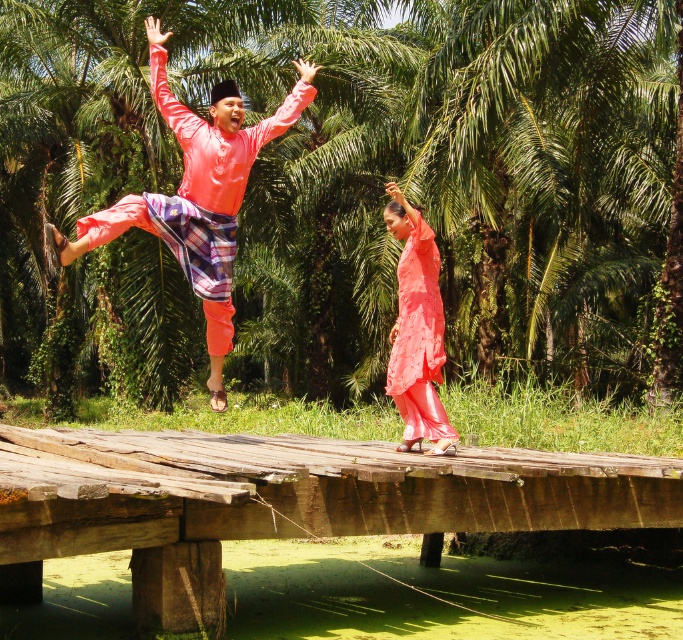
Question: Can you confirm if green leafy palm tree at upper center is thinner than shiny pink shirt at upper center?

Choices:
 (A) no
 (B) yes

Answer: (A)

Question: Is green leafy palm tree at upper center bigger than shiny pink shirt at upper center?

Choices:
 (A) yes
 (B) no

Answer: (A)

Question: Which object is the closest to the matte coral fabric dress at center?

Choices:
 (A) wooden bridge at center
 (B) green leafy palm tree at upper center

Answer: (A)

Question: Which point is farther to the camera?

Choices:
 (A) (81, 499)
 (B) (212, 364)
 (C) (419, 369)

Answer: (C)

Question: Is green leafy palm tree at upper center above shiny pink shirt at upper center?

Choices:
 (A) yes
 (B) no

Answer: (A)

Question: Which is nearer to the wooden bridge at center?

Choices:
 (A) matte coral fabric dress at center
 (B) shiny pink shirt at upper center
 (C) green leafy palm tree at upper center

Answer: (A)